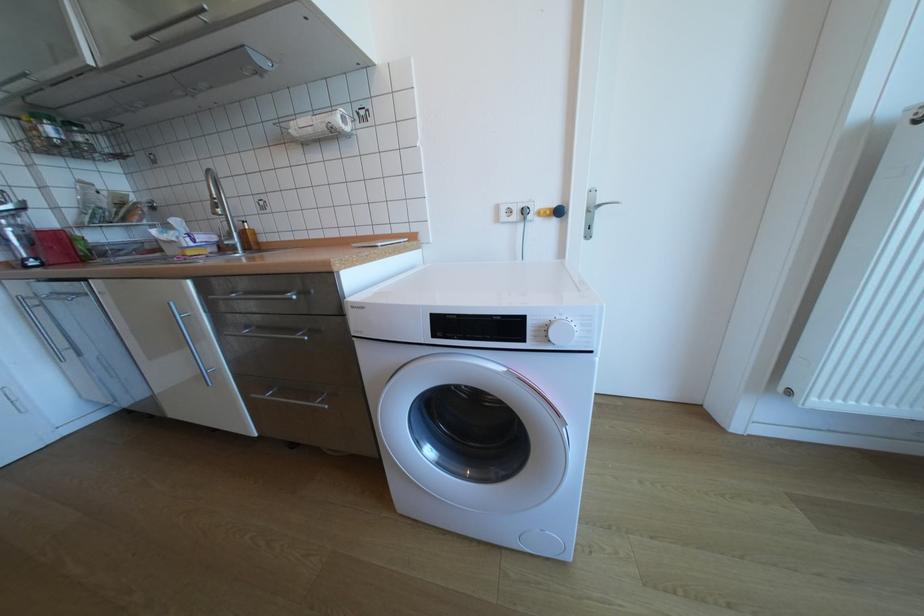
Locate an element on the screen. white control dial is located at coordinates (561, 331).